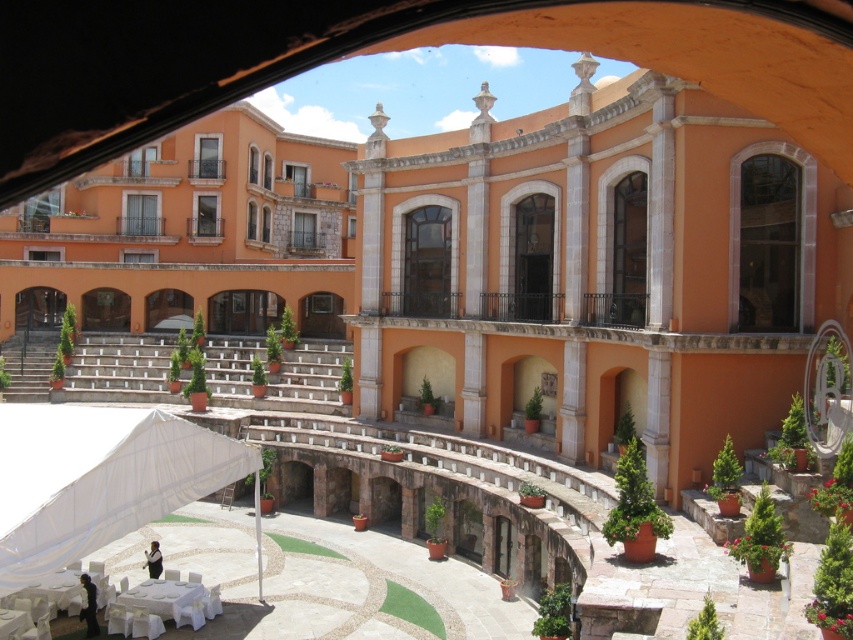
Question: Is white fabric canopy at lower left smaller than white cloth-covered table at lower center?

Choices:
 (A) yes
 (B) no

Answer: (B)

Question: Which of the following is the closest to the observer?

Choices:
 (A) white cloth-covered table at lower center
 (B) white fabric canopy at lower left

Answer: (B)

Question: Can you confirm if white fabric canopy at lower left is positioned above white cloth-covered table at lower center?

Choices:
 (A) no
 (B) yes

Answer: (B)

Question: Is white fabric canopy at lower left positioned at the back of white cloth-covered table at lower center?

Choices:
 (A) no
 (B) yes

Answer: (A)

Question: Which of the following is the farthest from the observer?

Choices:
 (A) white cloth-covered table at lower center
 (B) white fabric canopy at lower left

Answer: (A)

Question: Among these points, which one is farthest from the camera?

Choices:
 (A) (119, 616)
 (B) (64, 557)

Answer: (A)